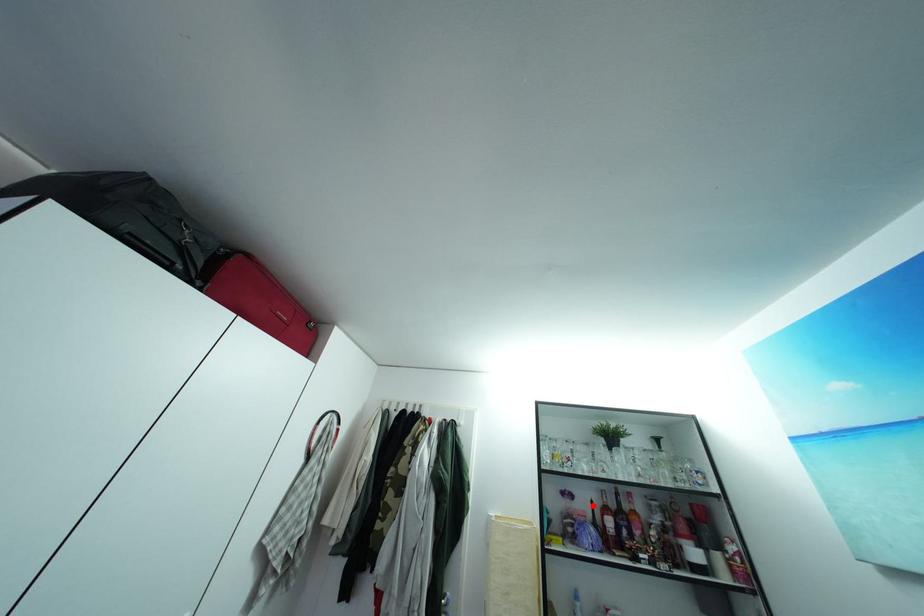
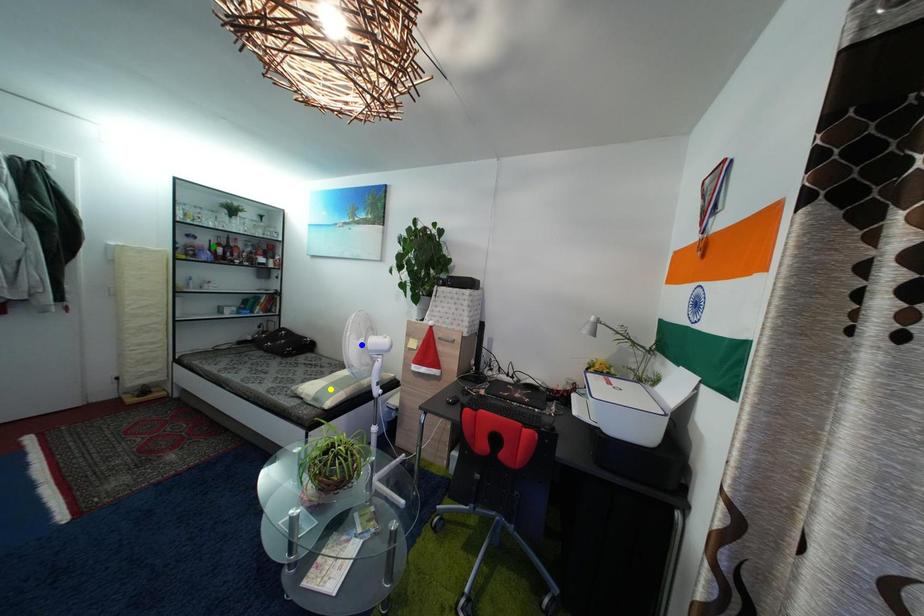
Question: I am providing you with two images of the same scene from different viewpoints. A red point is marked on the first image. You are given multiple points on the second image. Which mark in image 2 goes with the point in image 1?

Choices:
 (A) blue point
 (B) green point
 (C) yellow point

Answer: (B)